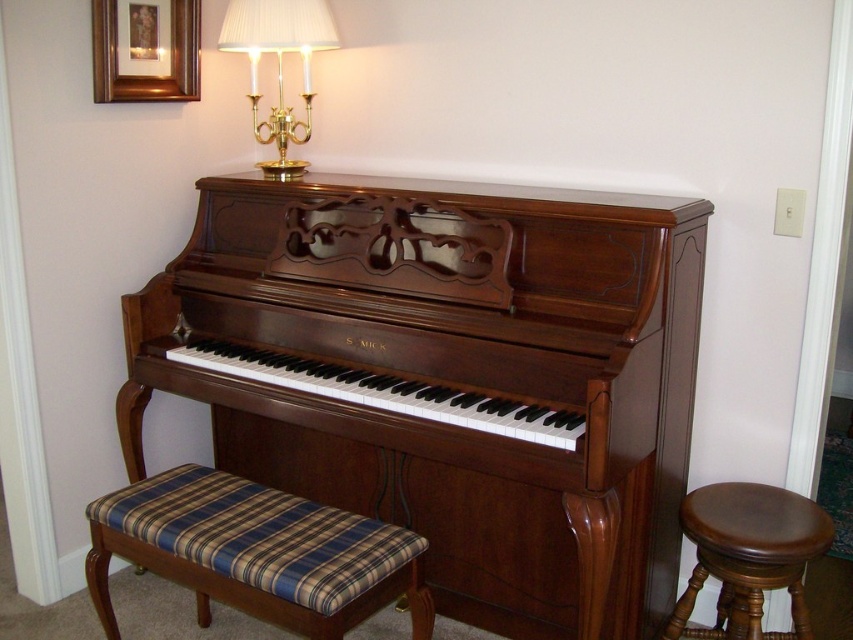
Measure the distance between point (469, 570) and camera.

They are 7.72 feet apart.

Does shiny brown piano at center have a larger size compared to gold-framed picture at upper left?

Yes.

Between point (303, 216) and point (109, 51), which one is positioned behind?

The point (303, 216) is behind.

The image size is (853, 640). I want to click on shiny brown piano at center, so click(448, 376).

Between shiny brown piano at center and brown leather stool at right, which one appears on the left side from the viewer's perspective?

shiny brown piano at center is more to the left.

Identify the location of shiny brown piano at center. (448, 376).

The image size is (853, 640). I want to click on shiny brown piano at center, so click(x=448, y=376).

Is point (469, 282) closer to camera compared to point (123, 536)?

No.

Is shiny brown piano at center to the left of plaid fabric bench at lower left from the viewer's perspective?

No, shiny brown piano at center is not to the left of plaid fabric bench at lower left.

Describe the element at coordinates (448, 376) in the screenshot. The height and width of the screenshot is (640, 853). I see `shiny brown piano at center` at that location.

Where is `shiny brown piano at center`? The image size is (853, 640). shiny brown piano at center is located at coordinates (448, 376).